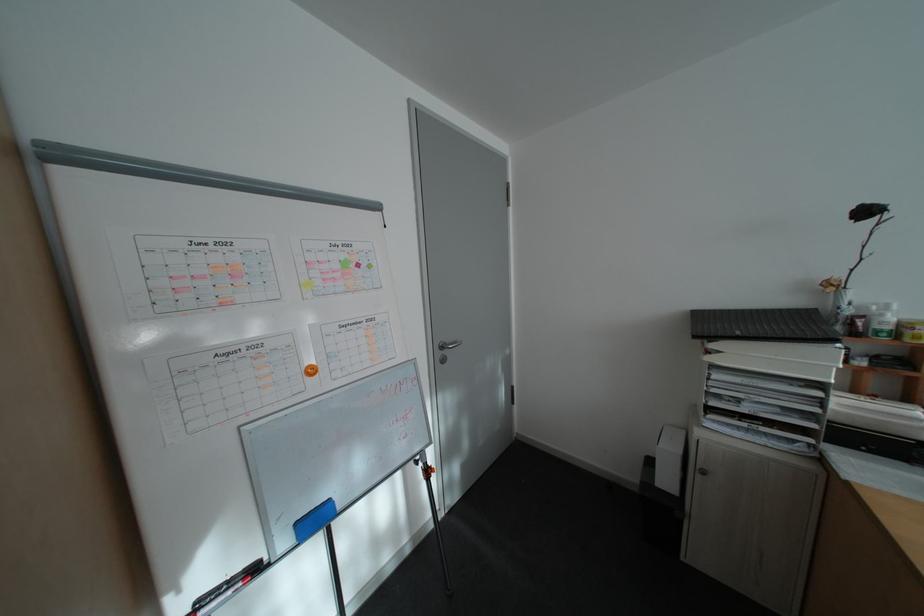
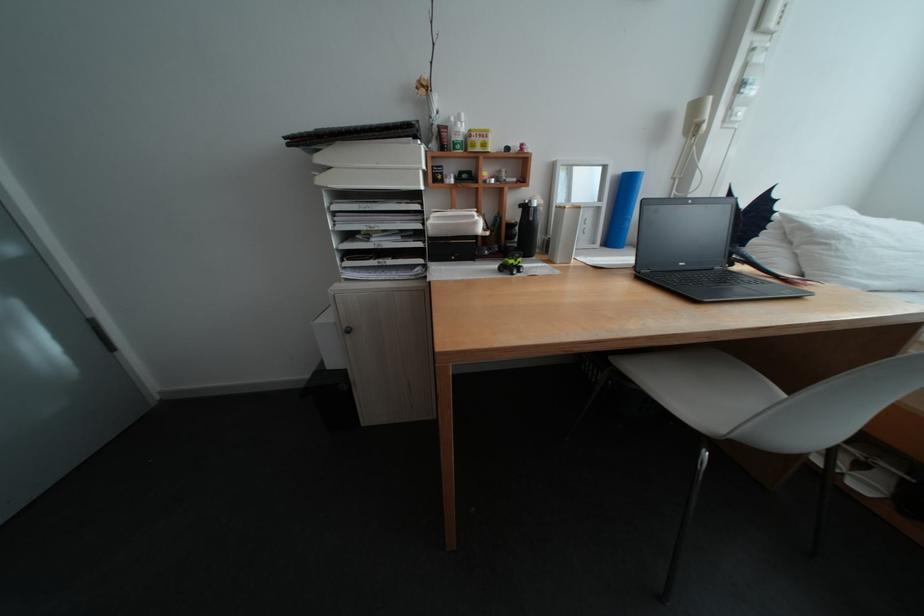
In the second image, find the point that corresponds to (725,346) in the first image.

(333, 160)